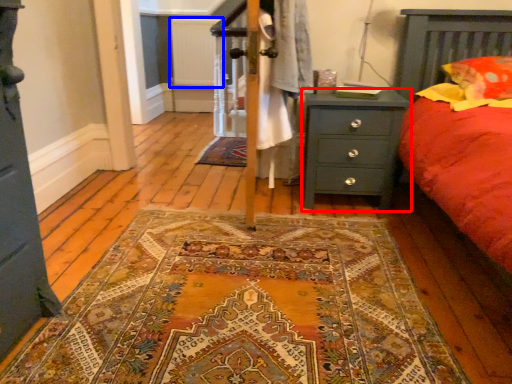
Question: Which object appears farthest to the camera in this image, nightstand (highlighted by a red box) or radiator (highlighted by a blue box)?

Choices:
 (A) nightstand
 (B) radiator

Answer: (B)